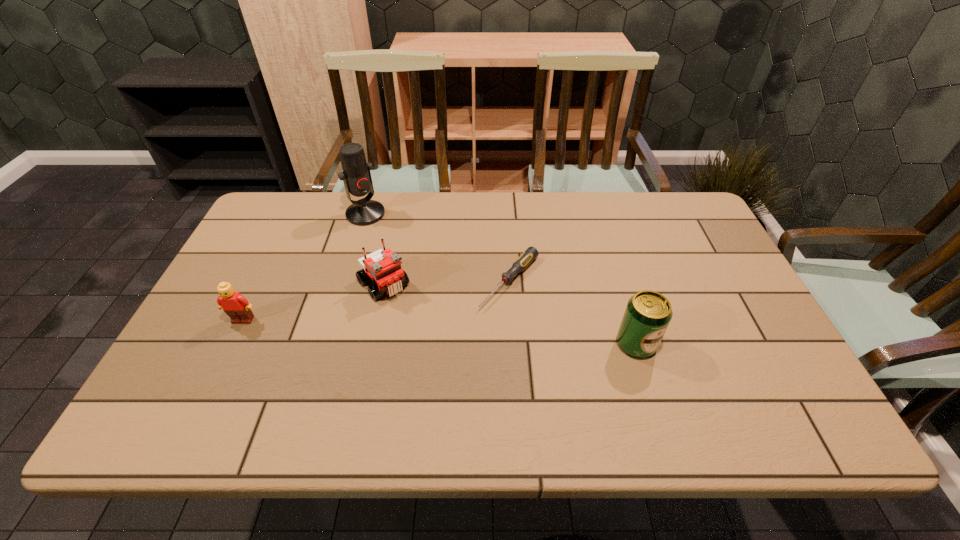
Find the location of `vacant spot on the desktop that is between the leftmost object and the rightmost object and is positioned on the front-facing side of the farther Lego`. vacant spot on the desktop that is between the leftmost object and the rightmost object and is positioned on the front-facing side of the farther Lego is located at coordinates (426, 331).

Image resolution: width=960 pixels, height=540 pixels. Identify the location of vacant space on the desktop that is between the left Lego and the beer can and is positioned insert the shortest object into a screw head. (459, 333).

Where is `free spot on the desktop that is between the nearer Lego and the beer can and is positioned on the side of the farthest object with the red ring`? The width and height of the screenshot is (960, 540). free spot on the desktop that is between the nearer Lego and the beer can and is positioned on the side of the farthest object with the red ring is located at coordinates (483, 335).